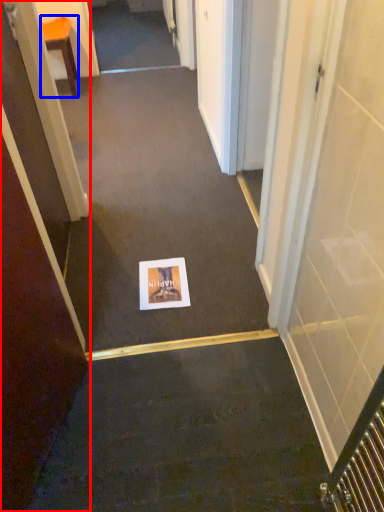
Question: Which of the following is the farthest to the observer, door (highlighted by a red box) or furniture (highlighted by a blue box)?

Choices:
 (A) door
 (B) furniture

Answer: (B)